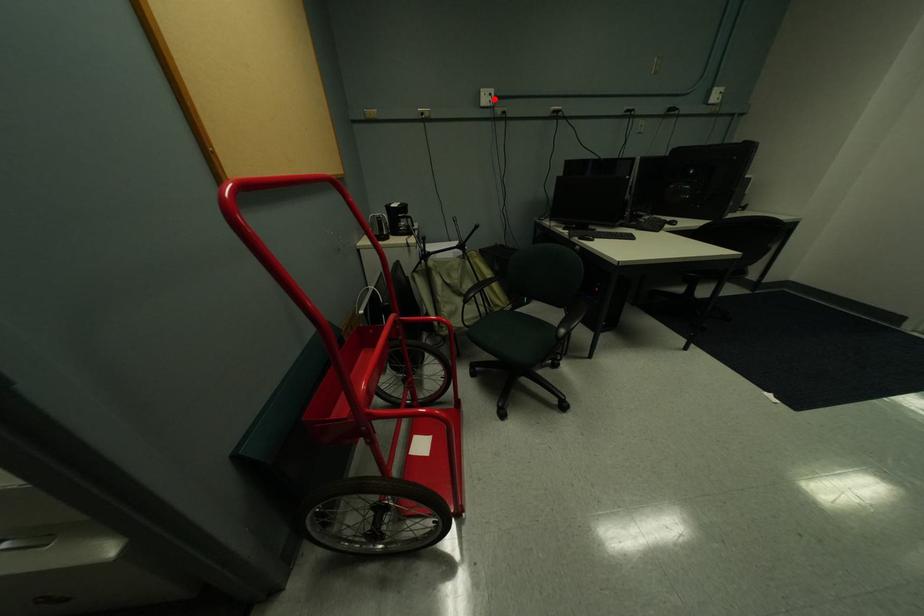
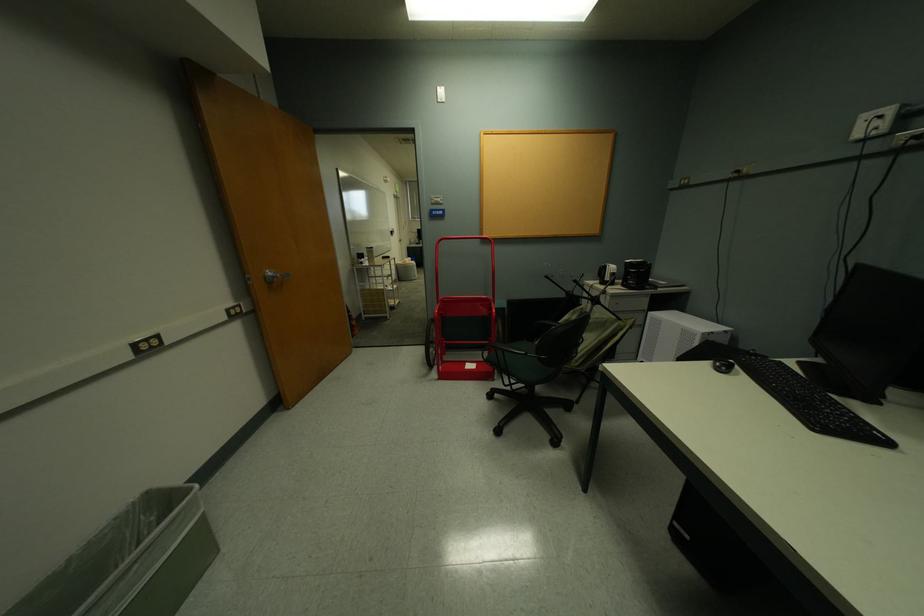
The point at the highlighted location is marked in the first image. Where is the corresponding point in the second image?

(881, 126)